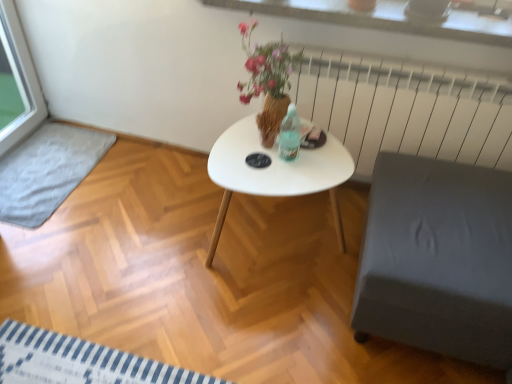
I want to click on blank area to the left of white matte coffee table at center, so click(160, 229).